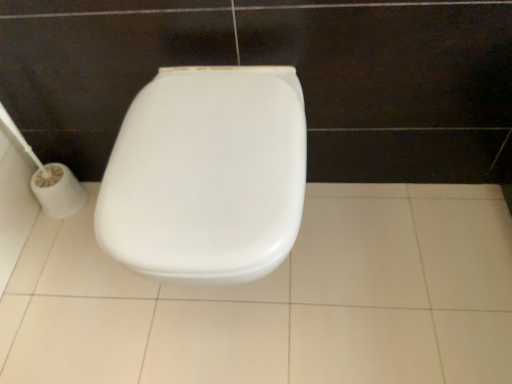
The width and height of the screenshot is (512, 384). Find the location of `vacant space positioned to the left of white plastic toilet at center`. vacant space positioned to the left of white plastic toilet at center is located at coordinates (77, 300).